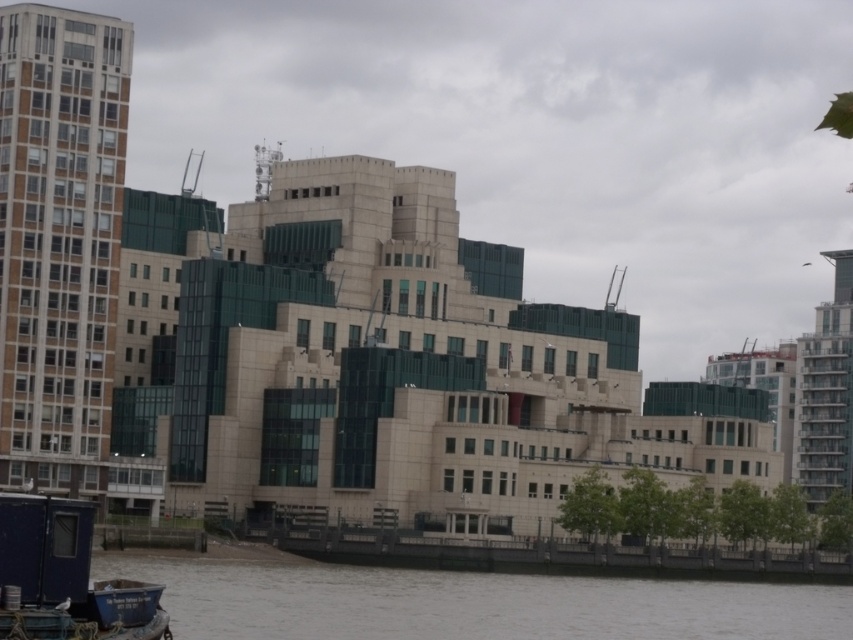
You are a photographer planning to capture the blue painted wood boat at lower left and the brown water at lower left in the same frame. Which object will occupy more horizontal space in your photo?

The brown water at lower left has a greater width than the blue painted wood boat at lower left, so it will occupy more horizontal space in the photo.

You are standing on the shore looking at the brown water at lower left and the blue painted wood boat at lower left. Which object is closer to you?

The brown water at lower left is closer to you because the blue painted wood boat at lower left is behind it.